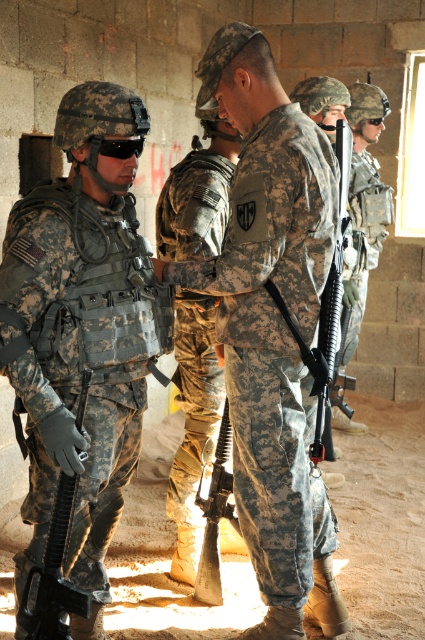
You are a military observer analyzing the scene. There is a camouflage uniform at center and a matte black rifle at left. Which object is positioned more to the left?

The matte black rifle at left is more to the left than the camouflage uniform at center.

You are a soldier in the group and need to quickly grab an item from the scene. Which item can you reach first if you are standing closer to the matte black rifle at left compared to the camouflage fabric uniform at right?

The matte black rifle at left is smaller than the camouflage fabric uniform at right, so you can reach the matte black rifle at left first since it is closer to you.

In the scene with soldiers in a partially constructed building, there are two soldiers wearing camouflage uniforms. The first is labeled as the camouflage uniform at left and the second as the camouflage fabric uniform at center. From the perspective of an observer looking at the image, which soldier is positioned to the right?

The camouflage fabric uniform at center is positioned to the right of the camouflage uniform at left.